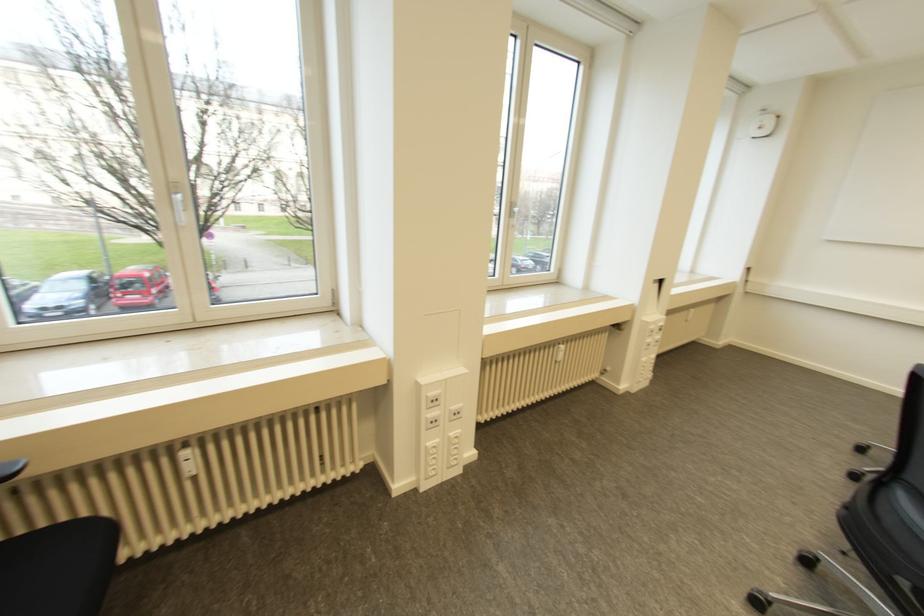
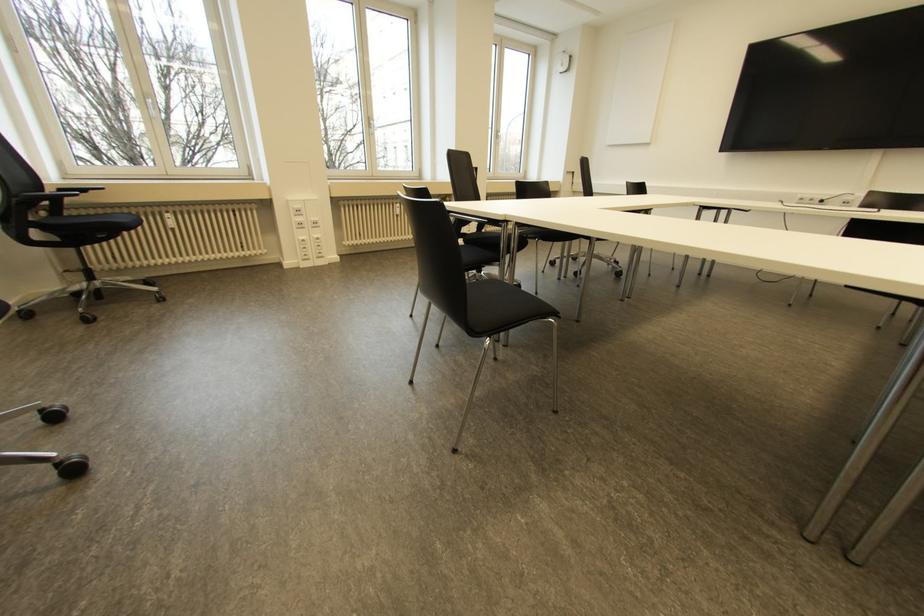
Locate, in the second image, the point that corresponds to point (561, 346) in the first image.

(397, 204)